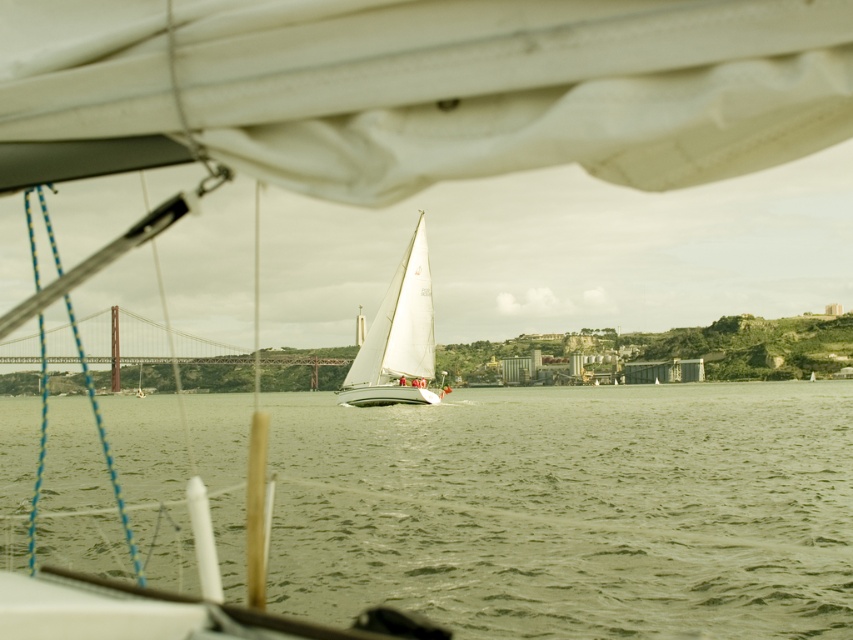
You are a photographer positioned at the origin point of the image. You want to capture a photo of the white matte sailboat at center. What are the coordinates where you should aim your camera?

The white matte sailboat at center is located at coordinates point (397, 337), so you should aim your camera at those coordinates to capture it.

You are a sailor on a boat that is 25 feet long. You want to navigate between the green water at center and the white matte sailboat at center. Can your boat fit through the space between them?

The green water at center is 63.75 feet away from the white matte sailboat at center. Since your boat is 25 feet long, it can easily fit through the space between them as the distance is more than twice the length of your boat.

You are a sailor navigating a boat and you see the green water at center and the white matte sailboat at center. Which object is positioned to the left of the other?

The green water at center is to the left of white matte sailboat at center.